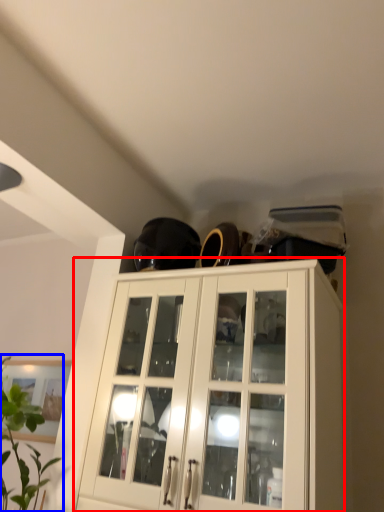
Question: Which object is closer to the camera taking this photo, cabinetry (highlighted by a red box) or houseplant (highlighted by a blue box)?

Choices:
 (A) cabinetry
 (B) houseplant

Answer: (B)